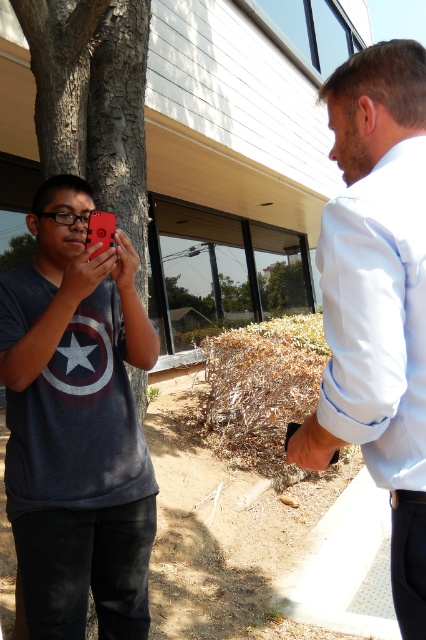
You are standing at the center of the image and want to walk to the smooth bark tree at left. In which direction should you go?

The smooth bark tree at left is located at point [92,99], so you should walk towards the left direction to reach it.

You are trying to decide whether to place a small decorative item on the ground next to the matte black phone at left and the smooth bark tree at left. Which object should you place it closer to if you want it to be near the smaller one?

You should place the decorative item closer to the matte black phone at left because it is smaller than the smooth bark tree at left.

You need to place a rectangular box that is 1.2 meters wide between the matte black phone at left and the white shirt at upper right. Based on their widths, will the box fit horizontally between them?

The matte black phone at left is wider than the white shirt at upper right. Since the box is 1.2 meters wide, and the phone is wider, the total space between them might be insufficient. However, without exact distance data, we can only confirm the width comparison. The box may not fit due to the phone taking up more width.